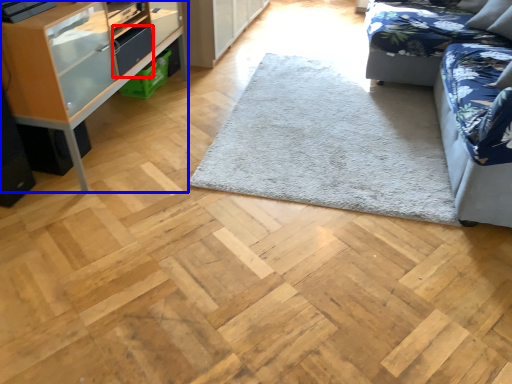
Question: Which point is closer to the camera, drawer (highlighted by a red box) or shelf (highlighted by a blue box)?

Choices:
 (A) drawer
 (B) shelf

Answer: (B)